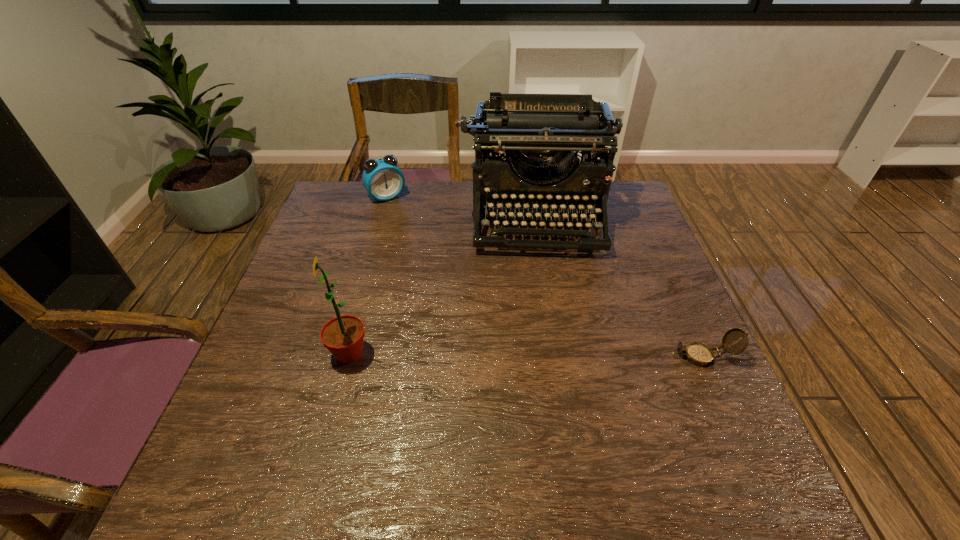
Locate an element on the screen. vacant area that lies between the alarm clock and the compass is located at coordinates (544, 276).

You are a GUI agent. You are given a task and a screenshot of the screen. Output one action in this format:
    pyautogui.click(x=<x>, y=<y>)
    Task: Click on the unoccupied position between the typewriter and the sunflower
    This screenshot has height=540, width=960.
    Given the screenshot: What is the action you would take?
    pyautogui.click(x=444, y=285)

Find the location of a particular element. free spot between the shortest object and the typewriter is located at coordinates (620, 286).

Where is `free space between the shortest object and the typewriter`? free space between the shortest object and the typewriter is located at coordinates (620, 286).

Locate an element on the screen. This screenshot has height=540, width=960. vacant space that is in between the shortest object and the alarm clock is located at coordinates click(x=544, y=276).

The height and width of the screenshot is (540, 960). Find the location of `unoccupied area between the shortest object and the typewriter`. unoccupied area between the shortest object and the typewriter is located at coordinates (620, 286).

Identify the location of blank region between the alarm clock and the shortest object. This screenshot has width=960, height=540. (544, 276).

Point out which object is positioned as the third nearest to the shortest object. Please provide its 2D coordinates. Your answer should be formatted as a tuple, i.e. [(x, y)], where the tuple contains the x and y coordinates of a point satisfying the conditions above.

[(382, 178)]

Select which object is the closest to the third tallest object. Please provide its 2D coordinates. Your answer should be formatted as a tuple, i.e. [(x, y)], where the tuple contains the x and y coordinates of a point satisfying the conditions above.

[(519, 127)]

The image size is (960, 540). Identify the location of free space that satisfies the following two spatial constraints: 1. on the front side of the alarm clock; 2. on the face of the compass. (342, 356).